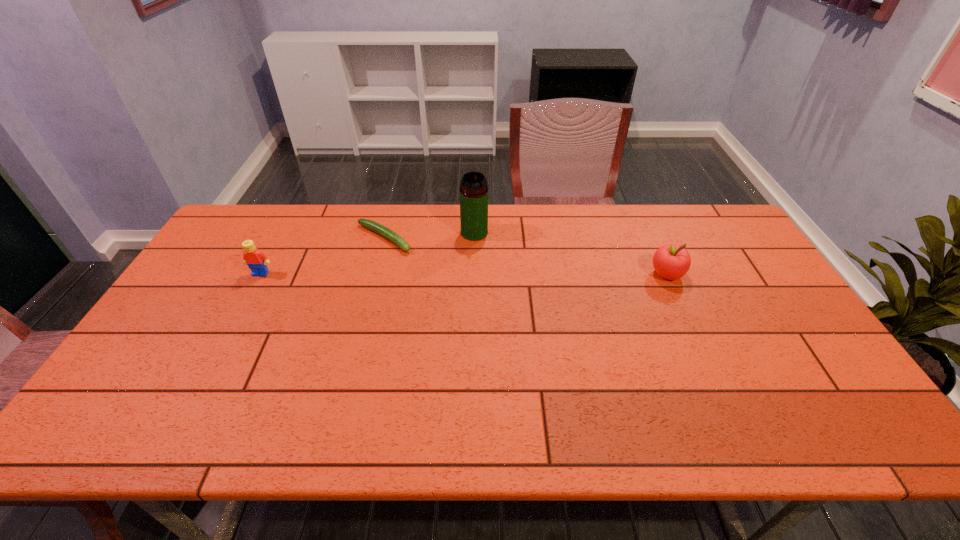
Where is `blank space located from the spout of the tallest object`? blank space located from the spout of the tallest object is located at coordinates (520, 316).

In order to click on vacant area situated on the front-facing side of the second object from left to right in this screenshot , I will do `click(437, 269)`.

What are the coordinates of `free space located 0.150m on the front-facing side of the second object from left to right` in the screenshot? It's located at (437, 269).

The image size is (960, 540). Identify the location of free location located on the front-facing side of the second object from left to right. (439, 271).

At what (x,y) coordinates should I click in order to perform the action: click on thermos bottle that is positioned at the far edge. Please return your answer as a coordinate pair (x, y). This screenshot has width=960, height=540. Looking at the image, I should click on (473, 189).

Identify the location of zucchini present at the far edge. The height and width of the screenshot is (540, 960). (369, 224).

Identify the location of free spot at the far edge of the desktop. The image size is (960, 540). (607, 220).

In the image, there is a desktop. In order to click on free space at the near edge in this screenshot , I will do `click(447, 387)`.

The height and width of the screenshot is (540, 960). What are the coordinates of `blank space at the left edge of the desktop` in the screenshot? It's located at 215,289.

The height and width of the screenshot is (540, 960). In the image, there is a desktop. In order to click on vacant space at the far left corner in this screenshot , I will do `click(251, 206)`.